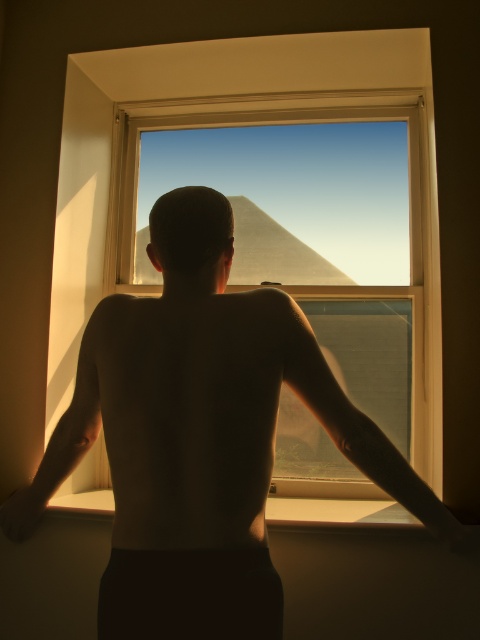
You are a photographer trying to capture the skinny bald man at center and the smooth skin at center in a single frame. Since the camera has a limited depth of field, which subject should you focus on to ensure the taller one is in sharp focus?

The skinny bald man at center is taller than smooth skin at center, so you should focus on the skinny bald man at center to ensure the taller one is in sharp focus.

You are a painter who wants to paint the scene. You have a 24 inch long brush. Can you reach from the clear glass window at center to the smooth skin at center without moving the brush?

The clear glass window at center and smooth skin at center are 29.13 inches apart from each other. Since the brush is only 24 inches long, you cannot reach the smooth skin at center from the clear glass window at center without moving the brush.